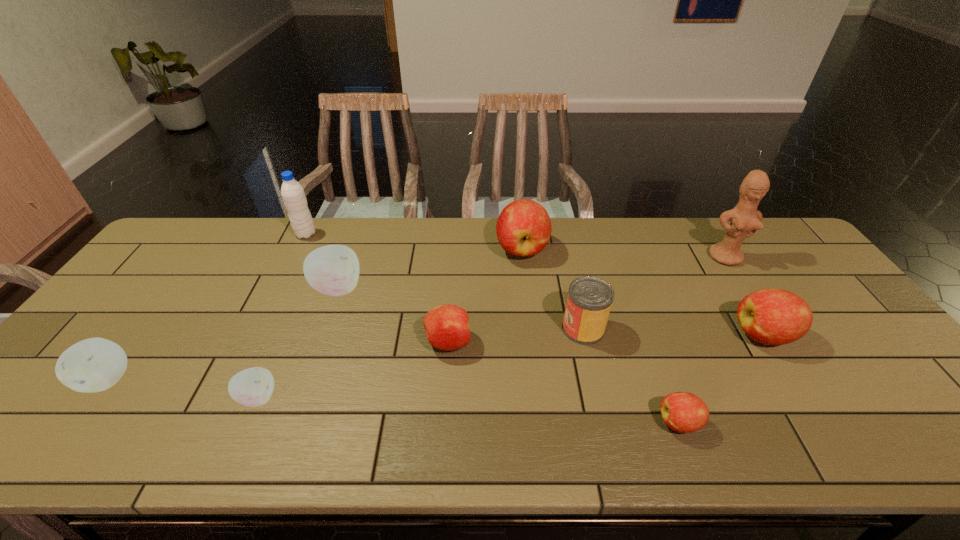
You are a GUI agent. You are given a task and a screenshot of the screen. Output one action in this format:
    pyautogui.click(x=<x>, y=<y>)
    Task: Click on the blank region between the fourth apple from right to left and the second tallest object
    The image size is (960, 540).
    Given the screenshot: What is the action you would take?
    pyautogui.click(x=377, y=288)

The height and width of the screenshot is (540, 960). In order to click on vacant space in between the leftmost red apple and the third smallest red apple in this screenshot , I will do `click(606, 339)`.

Where is `vacant space that's between the rightmost red apple and the smallest white apple`? The height and width of the screenshot is (540, 960). vacant space that's between the rightmost red apple and the smallest white apple is located at coordinates (511, 367).

Identify the location of free space between the rightmost red apple and the sixth nearest apple. The height and width of the screenshot is (540, 960). (550, 312).

Locate an element on the screen. unoccupied position between the leftmost object and the second smallest red apple is located at coordinates (278, 361).

This screenshot has width=960, height=540. Find the location of `free space between the third biggest red apple and the second farthest apple`. free space between the third biggest red apple and the second farthest apple is located at coordinates (393, 315).

Select which object appears as the fifth closest to the fourth farthest object. Please provide its 2D coordinates. Your answer should be formatted as a tuple, i.e. [(x, y)], where the tuple contains the x and y coordinates of a point satisfying the conditions above.

[(523, 228)]

Point out which object is positioned as the seventh nearest to the leftmost apple. Please provide its 2D coordinates. Your answer should be formatted as a tuple, i.e. [(x, y)], where the tuple contains the x and y coordinates of a point satisfying the conditions above.

[(683, 412)]

The image size is (960, 540). I want to click on apple that is the sixth nearest to the figurine, so click(x=252, y=387).

Select which apple appears as the fifth closest to the rightmost apple. Please provide its 2D coordinates. Your answer should be formatted as a tuple, i.e. [(x, y)], where the tuple contains the x and y coordinates of a point satisfying the conditions above.

[(252, 387)]